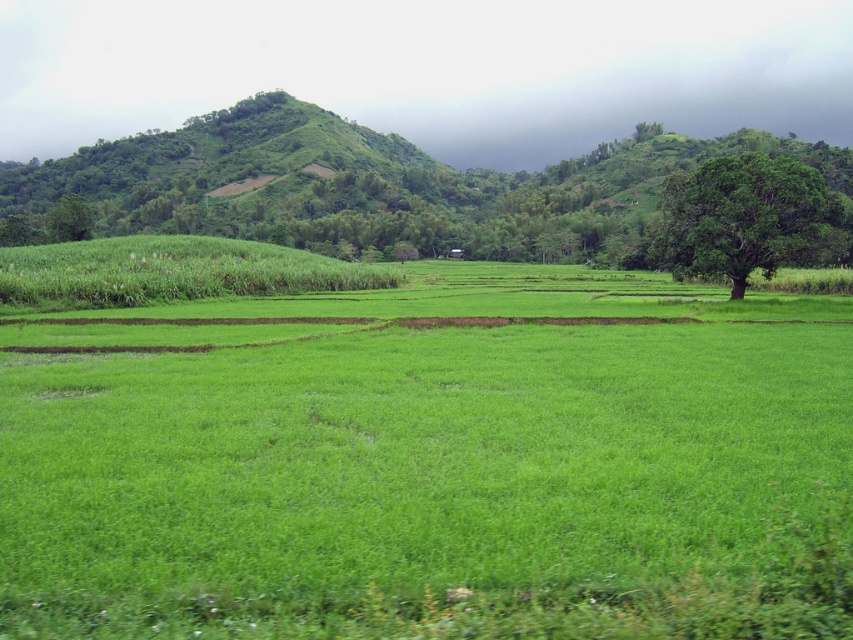
Based on the scene description, where is the green grassy field at center located in terms of coordinates?

The green grassy field at center is located at coordinates point (436,468).

You are standing in the middle of the agricultural fields in the foreground of this landscape. You see two points marked on the ground in front of you. The first point is at coordinate point (262,556) and the second is at point (230,108). Which point is closer to you?

Point (262,556) is closer to the viewer than point (230,108).